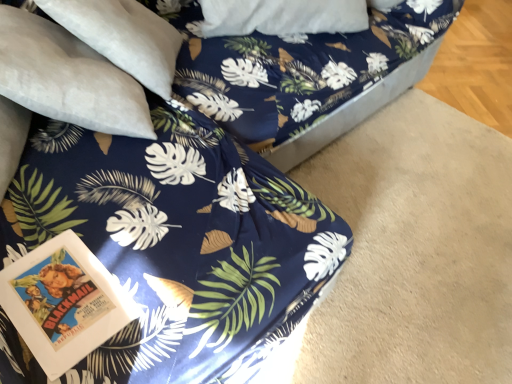
Question: Is blue fabric bed frame at center bigger or smaller than suede-like beige pillow at upper left?

Choices:
 (A) small
 (B) big

Answer: (B)

Question: From the image's perspective, is blue fabric bed frame at center above or below suede-like beige pillow at upper left?

Choices:
 (A) below
 (B) above

Answer: (B)

Question: Looking at their shapes, would you say blue fabric bed frame at center is wider or thinner than suede-like beige pillow at upper left?

Choices:
 (A) wide
 (B) thin

Answer: (A)

Question: Considering the positions of suede-like beige pillow at upper left and blue fabric bed frame at center in the image, is suede-like beige pillow at upper left wider or thinner than blue fabric bed frame at center?

Choices:
 (A) wide
 (B) thin

Answer: (B)

Question: Is suede-like beige pillow at upper left in front of or behind blue fabric bed frame at center in the image?

Choices:
 (A) front
 (B) behind

Answer: (A)

Question: Is suede-like beige pillow at upper left taller or shorter than blue fabric bed frame at center?

Choices:
 (A) tall
 (B) short

Answer: (B)

Question: Is suede-like beige pillow at upper left bigger or smaller than blue fabric bed frame at center?

Choices:
 (A) big
 (B) small

Answer: (B)